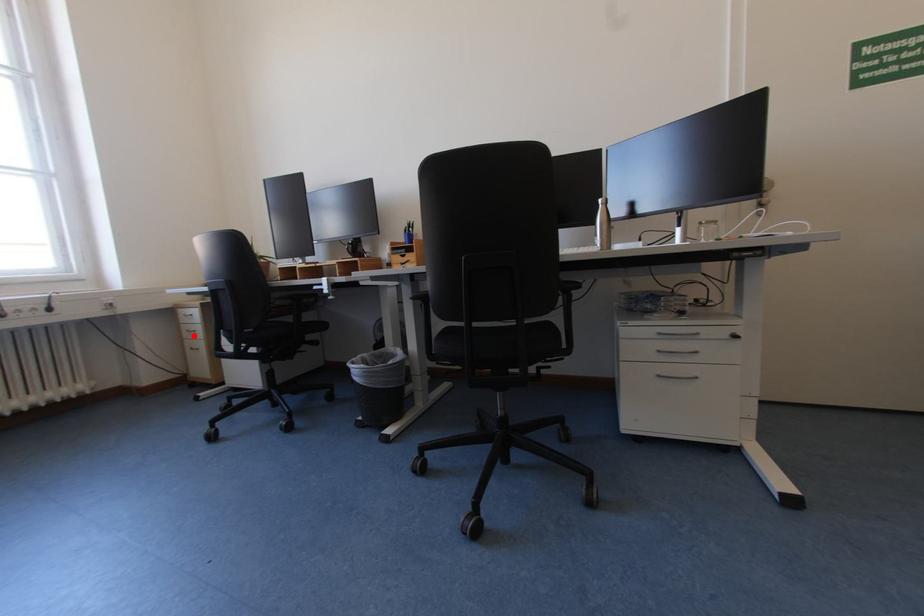
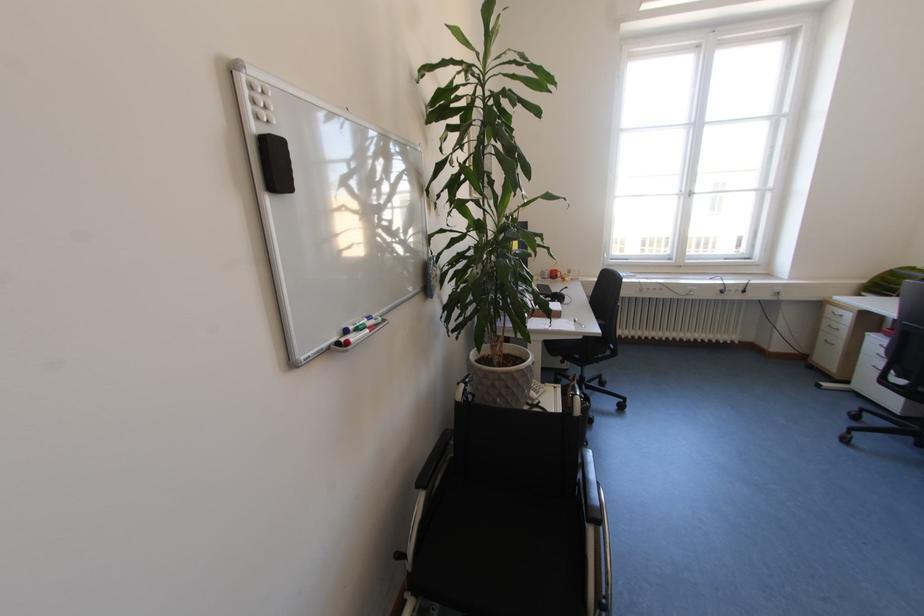
Question: A red point is marked in image1. In image2, is the corresponding 3D point closer to the camera or farther? Reply with the corresponding letter.

Choices:
 (A) The corresponding 3D point is closer.
 (B) The corresponding 3D point is farther.

Answer: (B)